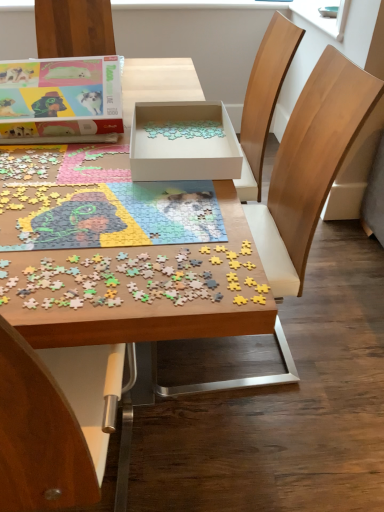
Question: Are wooden puzzle pieces at center, acting as the 1th jigsaw puzzle starting from the top, and wooden puzzle pieces at center making contact?

Choices:
 (A) no
 (B) yes

Answer: (A)

Question: Could you tell me if wooden puzzle pieces at center, marked as the second jigsaw puzzle in a front-to-back arrangement, is turned towards wooden puzzle pieces at center?

Choices:
 (A) yes
 (B) no

Answer: (A)

Question: From the image's perspective, does wooden puzzle pieces at center, marked as the second jigsaw puzzle in a front-to-back arrangement, appear lower than wooden puzzle pieces at center?

Choices:
 (A) yes
 (B) no

Answer: (B)

Question: From the image's perspective, is wooden puzzle pieces at center, marked as the second jigsaw puzzle in a front-to-back arrangement, on top of wooden puzzle pieces at center?

Choices:
 (A) no
 (B) yes

Answer: (B)

Question: Is wooden puzzle pieces at center, marked as the 2th jigsaw puzzle in a bottom-to-top arrangement, shorter than wooden puzzle pieces at center?

Choices:
 (A) no
 (B) yes

Answer: (B)

Question: Is wooden puzzle pieces at center a part of wooden puzzle pieces at center, marked as the 2th jigsaw puzzle in a bottom-to-top arrangement?

Choices:
 (A) no
 (B) yes

Answer: (A)

Question: Considering the relative sizes of white cardboard box at center, the second box when ordered from left to right, and wooden puzzle pieces at center in the image provided, is white cardboard box at center, the second box when ordered from left to right, thinner than wooden puzzle pieces at center?

Choices:
 (A) no
 (B) yes

Answer: (B)

Question: Does white cardboard box at center, the 1th box in the right-to-left sequence, have a larger size compared to wooden puzzle pieces at center?

Choices:
 (A) yes
 (B) no

Answer: (B)

Question: From a real-world perspective, is white cardboard box at center, the 1th box in the right-to-left sequence, over wooden puzzle pieces at center?

Choices:
 (A) yes
 (B) no

Answer: (A)

Question: From the image's perspective, is white cardboard box at center, the second box when ordered from left to right, on top of wooden puzzle pieces at center?

Choices:
 (A) yes
 (B) no

Answer: (A)

Question: Does white cardboard box at center, the 1th box in the right-to-left sequence, have a greater width compared to wooden puzzle pieces at center?

Choices:
 (A) no
 (B) yes

Answer: (A)

Question: Is white cardboard box at center, the 1th box in the right-to-left sequence, smaller than wooden puzzle pieces at center?

Choices:
 (A) yes
 (B) no

Answer: (A)

Question: Is matte cardboard box at upper left, placed as the 2th box when sorted from right to left, to the right of wooden chair at center from the viewer's perspective?

Choices:
 (A) no
 (B) yes

Answer: (A)